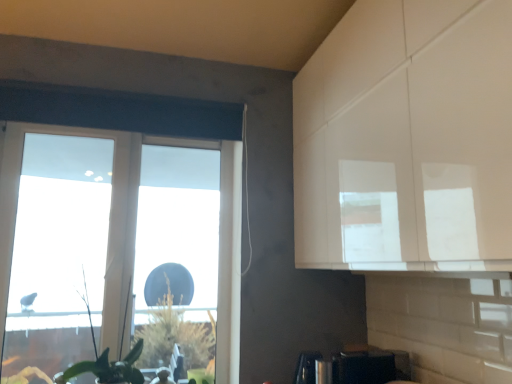
Question: Is green leafy plant at lower left completely or partially inside transparent plastic window at left?

Choices:
 (A) yes
 (B) no

Answer: (B)

Question: Is transparent plastic window at left to the left of green leafy plant at lower left from the viewer's perspective?

Choices:
 (A) no
 (B) yes

Answer: (B)

Question: Does transparent plastic window at left have a greater height compared to green leafy plant at lower left?

Choices:
 (A) no
 (B) yes

Answer: (B)

Question: Does transparent plastic window at left have a greater width compared to green leafy plant at lower left?

Choices:
 (A) no
 (B) yes

Answer: (A)

Question: Is transparent plastic window at left shorter than green leafy plant at lower left?

Choices:
 (A) yes
 (B) no

Answer: (B)

Question: Could you tell me if transparent plastic window at left is turned towards green leafy plant at lower left?

Choices:
 (A) yes
 (B) no

Answer: (A)

Question: Is transparent plastic window at left located outside satin black toaster at lower center?

Choices:
 (A) yes
 (B) no

Answer: (A)

Question: Is transparent plastic window at left in front of satin black toaster at lower center?

Choices:
 (A) no
 (B) yes

Answer: (A)

Question: From the image's perspective, is transparent plastic window at left on satin black toaster at lower center?

Choices:
 (A) yes
 (B) no

Answer: (A)

Question: Considering the relative sizes of transparent plastic window at left and satin black toaster at lower center in the image provided, is transparent plastic window at left smaller than satin black toaster at lower center?

Choices:
 (A) yes
 (B) no

Answer: (B)

Question: Considering the relative positions of transparent plastic window at left and satin black toaster at lower center in the image provided, is transparent plastic window at left to the left of satin black toaster at lower center from the viewer's perspective?

Choices:
 (A) no
 (B) yes

Answer: (B)

Question: Can you confirm if transparent plastic window at left is positioned to the right of satin black toaster at lower center?

Choices:
 (A) no
 (B) yes

Answer: (A)

Question: Does satin black toaster at lower center have a greater width compared to transparent plastic window at left?

Choices:
 (A) yes
 (B) no

Answer: (A)